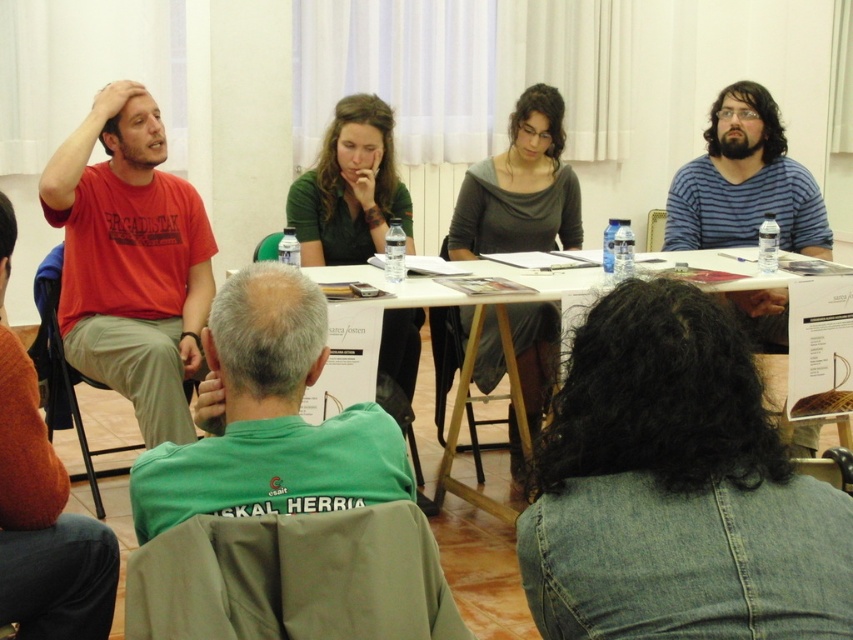
Does point (724, 484) lie in front of point (550, 280)?

Yes, point (724, 484) is in front of point (550, 280).

Which is below, denim jacket at lower right or white paper at center?

Positioned lower is white paper at center.

Describe the element at coordinates (675, 490) in the screenshot. I see `denim jacket at lower right` at that location.

Locate an element on the screen. The height and width of the screenshot is (640, 853). denim jacket at lower right is located at coordinates (675, 490).

Between point (137, 460) and point (785, 202), which one is positioned in front?

Positioned in front is point (137, 460).

This screenshot has height=640, width=853. Find the location of `green fabric shirt at lower left`. green fabric shirt at lower left is located at coordinates (270, 419).

Is point (287, 387) positioned before point (821, 244)?

Yes, it is in front of point (821, 244).

Locate an element on the screen. The height and width of the screenshot is (640, 853). green fabric shirt at lower left is located at coordinates (270, 419).

In the scene shown: Does matte red shirt at left have a lesser height compared to green fabric shirt at lower left?

No.

Which is more to the left, matte red shirt at left or green fabric shirt at lower left?

matte red shirt at left

What do you see at coordinates (131, 260) in the screenshot?
I see `matte red shirt at left` at bounding box center [131, 260].

At what (x,y) coordinates should I click in order to perform the action: click on matte red shirt at left. Please return your answer as a coordinate pair (x, y). The width and height of the screenshot is (853, 640). Looking at the image, I should click on point(131,260).